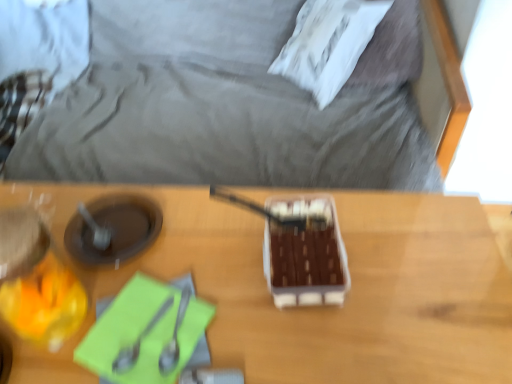
Question: Is wooden table at center taller or shorter than brown matte chocolate bar at center?

Choices:
 (A) tall
 (B) short

Answer: (A)

Question: Looking at the image, does wooden table at center seem bigger or smaller compared to brown matte chocolate bar at center?

Choices:
 (A) small
 (B) big

Answer: (B)

Question: Estimate the real-world distances between objects in this image. Which object is farther from the brown matte chocolate bar at center?

Choices:
 (A) satin silver spoon at lower left, which is the second utensil in right-to-left order
 (B) green matte notepad at lower left
 (C) wooden table at center
 (D) satin silver spoon at center, marked as the 1th utensil in a right-to-left arrangement
 (E) white soft pillow at upper center

Answer: (E)

Question: Which of these objects is positioned farthest from the wooden table at center?

Choices:
 (A) green matte notepad at lower left
 (B) brown matte chocolate bar at center
 (C) white soft pillow at upper center
 (D) satin silver spoon at center, the second utensil positioned from the left
 (E) satin silver spoon at lower left, which is the second utensil in right-to-left order

Answer: (C)